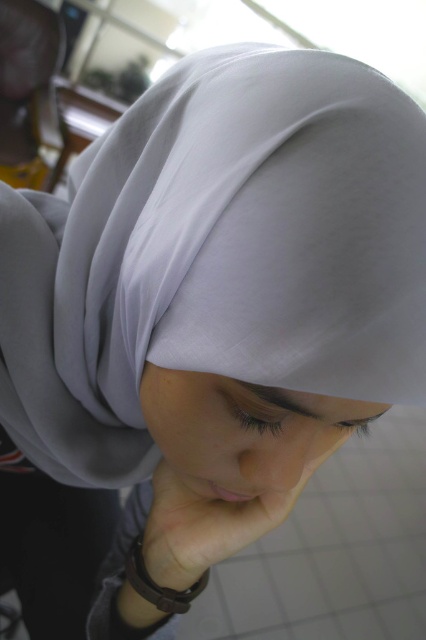
Looking at the person in the image, where is the smooth skin at center in relation to the pink smooth skin at lower center?

The smooth skin at center is to the right of the pink smooth skin at lower center.

You are a photographer adjusting the focus on your camera. You want to ensure both the smooth skin at center and the pink smooth skin at lower center are in focus. The depth of field in your current setting allows objects within 1.5 inches of each other to be sharp. Can both areas be in focus with your current settings?

The distance between the smooth skin at center and the pink smooth skin at lower center is 1.89 inches. Since your depth of field only allows objects within 1.5 inches to be sharp, both areas cannot be in focus simultaneously with your current settings.